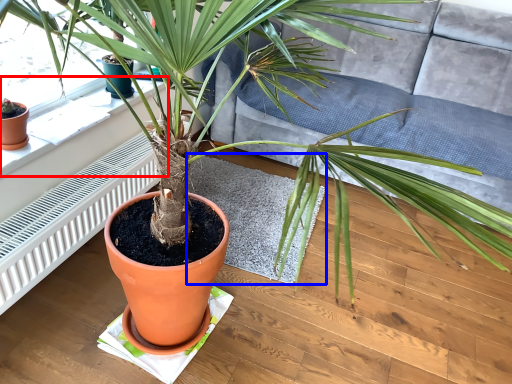
Question: Which object appears farthest to the camera in this image, window sill (highlighted by a red box) or mat (highlighted by a blue box)?

Choices:
 (A) window sill
 (B) mat

Answer: (B)